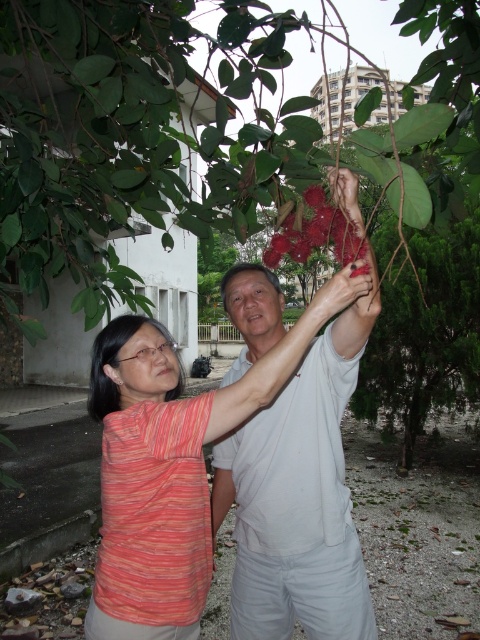
Question: Is striped cotton shirt at center to the left of white cotton shirt at center from the viewer's perspective?

Choices:
 (A) no
 (B) yes

Answer: (B)

Question: Which is farther from the striped cotton shirt at center?

Choices:
 (A) glossy red fruit at upper center
 (B) glossy red flower at center
 (C) white cotton shirt at center

Answer: (A)

Question: Which object appears closest to the camera in this image?

Choices:
 (A) glossy red flower at center
 (B) glossy red fruit at upper center

Answer: (B)

Question: Does striped cotton shirt at center come behind glossy red flower at center?

Choices:
 (A) yes
 (B) no

Answer: (B)

Question: Can you confirm if glossy red fruit at upper center is bigger than striped cotton shirt at center?

Choices:
 (A) no
 (B) yes

Answer: (B)

Question: Which is farther from the striped cotton shirt at center?

Choices:
 (A) glossy red fruit at upper center
 (B) glossy red flower at center

Answer: (A)